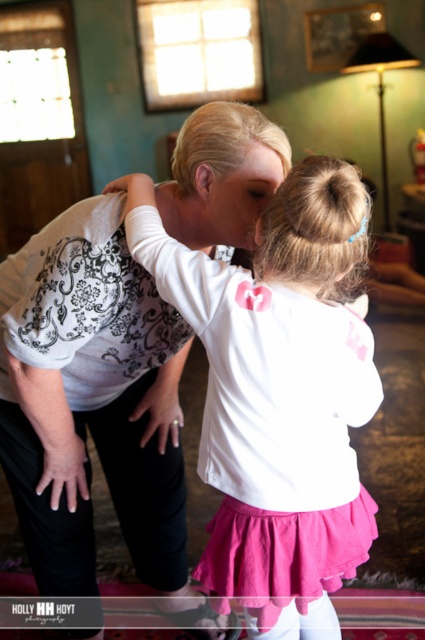
You are standing in the scene and want to move from the point at coordinates point (2, 268) to the point at coordinates point (317, 625). Is the destination point behind or in front of your starting position?

The destination point at coordinates point (317, 625) is behind the starting point at coordinates point (2, 268) since the starting point is in front of the destination point.

You are standing in the room and want to reach the point at coordinates (x=121, y=266). The room has a sofa placed 2 meters away from you. Can you walk straight to the point without passing the sofa?

The point at coordinates (x=121, y=266) is 1.36 meters away from you, which is closer than the sofa that is 2 meters away. Therefore, you can walk straight to the point without passing the sofa.

You are a photographer trying to capture the girl in the image. The girl is wearing two shirts. Which one is visible on top, the white lace shirt at center or the white matte shirt at center?

The white lace shirt at center is positioned over the white matte shirt at center, so the white lace shirt at center is visible on top.